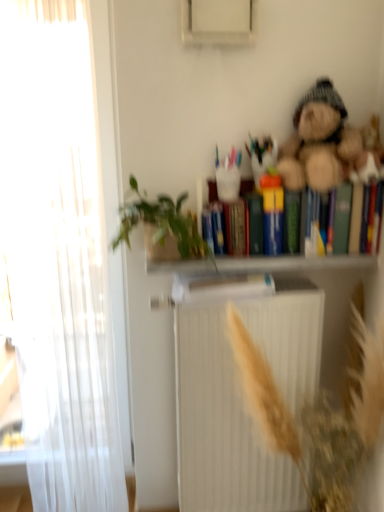
Question: Is multicolored hardcover books at upper right behind fuzzy brown teddy bear at upper right?

Choices:
 (A) no
 (B) yes

Answer: (B)

Question: From a real-world perspective, does multicolored hardcover books at upper right sit lower than fuzzy brown teddy bear at upper right?

Choices:
 (A) yes
 (B) no

Answer: (A)

Question: Considering the relative positions of multicolored hardcover books at upper right and fuzzy brown teddy bear at upper right in the image provided, is multicolored hardcover books at upper right to the right of fuzzy brown teddy bear at upper right from the viewer's perspective?

Choices:
 (A) no
 (B) yes

Answer: (B)

Question: Does multicolored hardcover books at upper right have a larger size compared to fuzzy brown teddy bear at upper right?

Choices:
 (A) no
 (B) yes

Answer: (A)

Question: Considering the relative positions of multicolored hardcover books at upper right and fuzzy brown teddy bear at upper right in the image provided, is multicolored hardcover books at upper right to the left of fuzzy brown teddy bear at upper right from the viewer's perspective?

Choices:
 (A) no
 (B) yes

Answer: (A)

Question: Looking at the image, does white matte bookcase at upper center seem bigger or smaller compared to multicolored hardcover books at upper right?

Choices:
 (A) small
 (B) big

Answer: (B)

Question: Considering the positions of white matte bookcase at upper center and multicolored hardcover books at upper right in the image, is white matte bookcase at upper center taller or shorter than multicolored hardcover books at upper right?

Choices:
 (A) tall
 (B) short

Answer: (A)

Question: Considering the positions of white matte bookcase at upper center and multicolored hardcover books at upper right in the image, is white matte bookcase at upper center wider or thinner than multicolored hardcover books at upper right?

Choices:
 (A) thin
 (B) wide

Answer: (B)

Question: Is white matte bookcase at upper center in front of or behind multicolored hardcover books at upper right in the image?

Choices:
 (A) front
 (B) behind

Answer: (A)

Question: Considering the positions of white matte bookcase at upper center and white sheer curtain at left in the image, is white matte bookcase at upper center taller or shorter than white sheer curtain at left?

Choices:
 (A) short
 (B) tall

Answer: (A)

Question: Is point (162, 457) closer or farther from the camera than point (9, 282)?

Choices:
 (A) closer
 (B) farther

Answer: (B)

Question: Considering their positions, is white matte bookcase at upper center located in front of or behind white sheer curtain at left?

Choices:
 (A) behind
 (B) front

Answer: (B)

Question: Which is correct: white matte bookcase at upper center is inside white sheer curtain at left, or outside of it?

Choices:
 (A) outside
 (B) inside

Answer: (A)

Question: From the image's perspective, is white matte radiator at center positioned above or below green leafy plant at upper center?

Choices:
 (A) above
 (B) below

Answer: (B)

Question: Considering the positions of point (233, 464) and point (210, 253), is point (233, 464) closer or farther from the camera than point (210, 253)?

Choices:
 (A) farther
 (B) closer

Answer: (A)